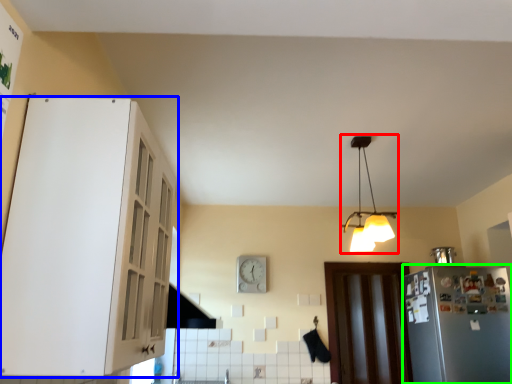
Question: Estimate the real-world distances between objects in this image. Which object is farther from lamp (highlighted by a red box), cabinetry (highlighted by a blue box) or refrigerator (highlighted by a green box)?

Choices:
 (A) cabinetry
 (B) refrigerator

Answer: (A)